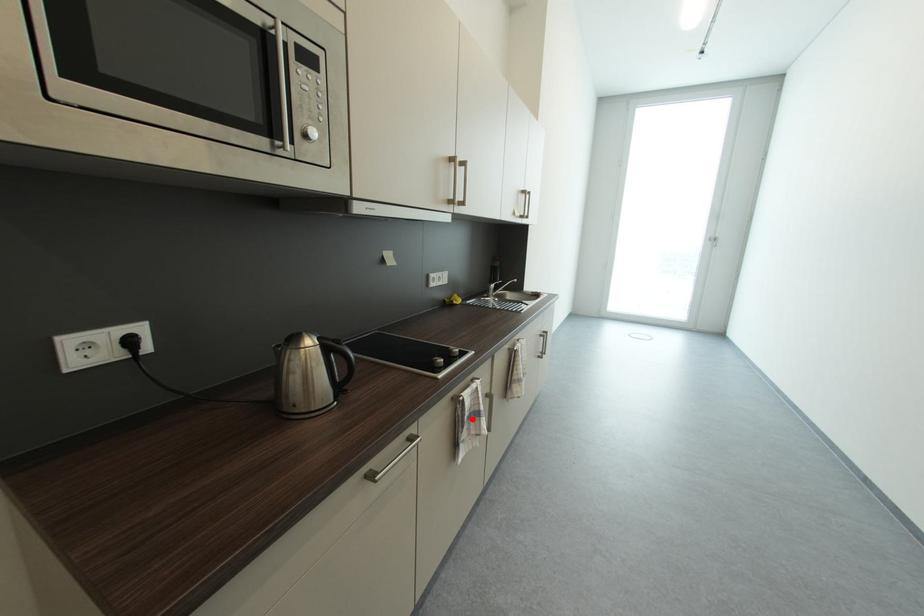
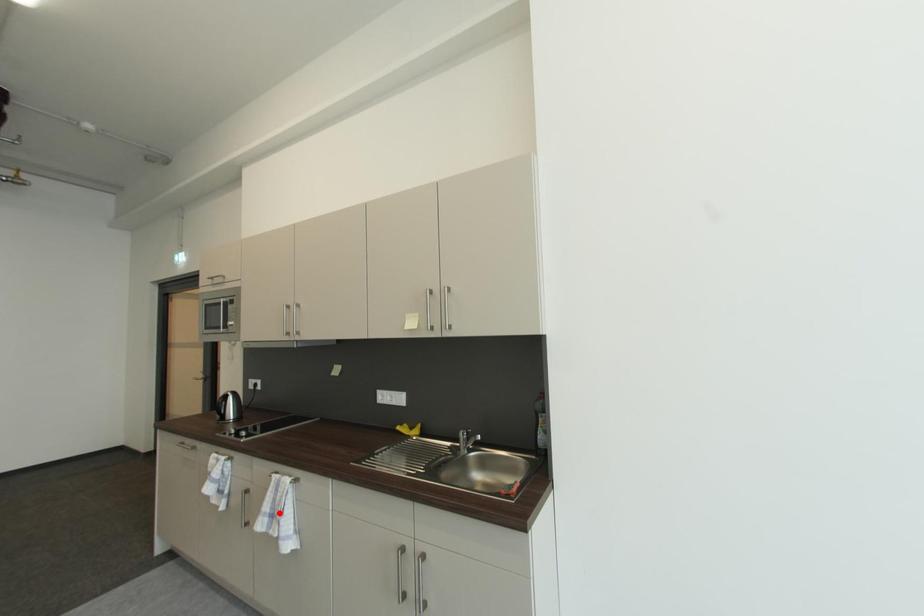
I am providing you with two images of the same scene from different viewpoints. A red point is marked on the first image and another point is marked on the second image. Is the marked point in image1 the same physical position as the marked point in image2?

No